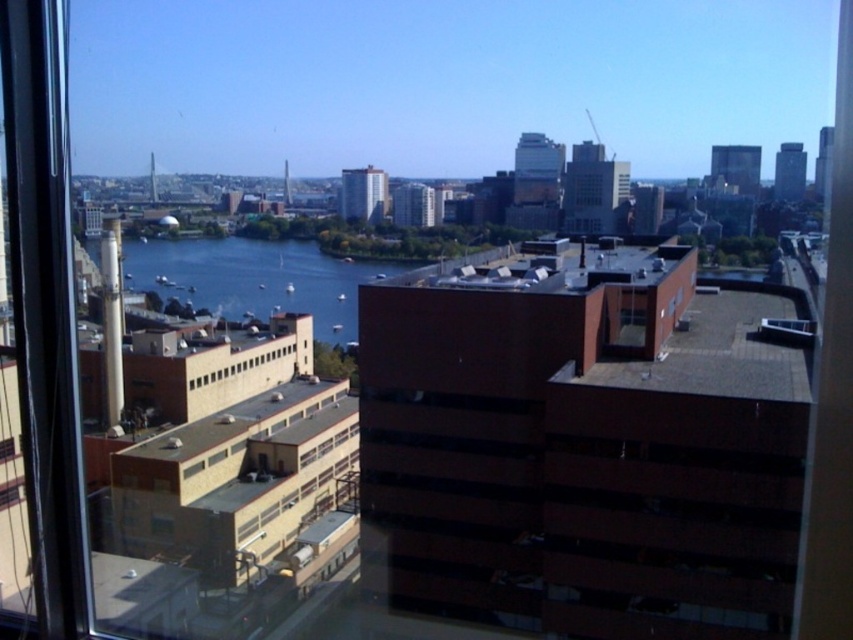
Question: Is blue water at center smaller than yellow matte building at lower left?

Choices:
 (A) no
 (B) yes

Answer: (A)

Question: Does blue water at center have a lesser width compared to yellow matte building at lower left?

Choices:
 (A) no
 (B) yes

Answer: (A)

Question: Which of the following is the farthest from the observer?

Choices:
 (A) yellow matte building at lower left
 (B) blue water at center

Answer: (B)

Question: Among these points, which one is farthest from the camera?

Choices:
 (A) (277, 355)
 (B) (306, 250)

Answer: (B)

Question: Where is blue water at center located in relation to yellow matte building at lower left in the image?

Choices:
 (A) left
 (B) right

Answer: (A)

Question: Which point is closer to the camera taking this photo?

Choices:
 (A) (323, 280)
 (B) (303, 360)

Answer: (B)